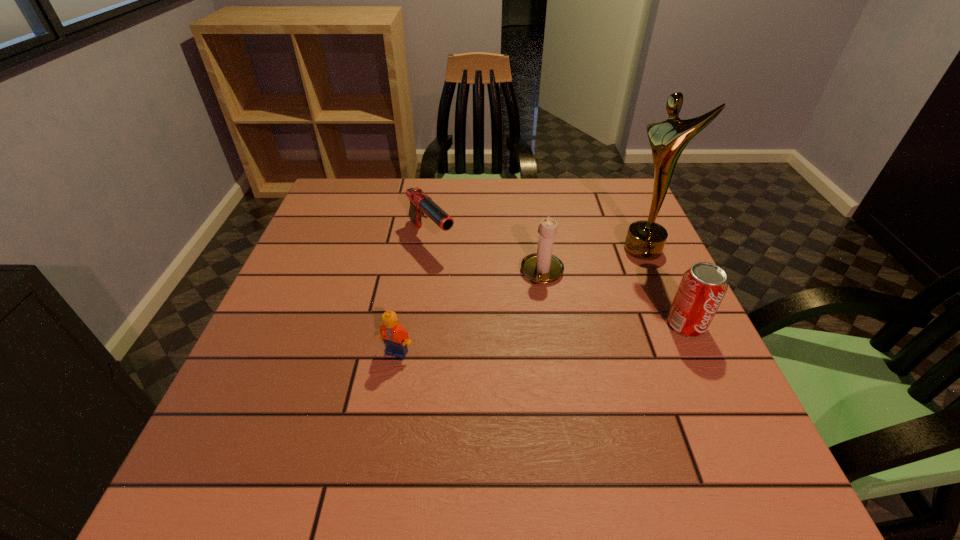
At what (x,y) coordinates should I click in order to perform the action: click on free space that satisfies the following two spatial constraints: 1. on the front side of the tallest object; 2. on the left side of the gun. Please return your answer as a coordinate pair (x, y). This screenshot has height=540, width=960. Looking at the image, I should click on (429, 250).